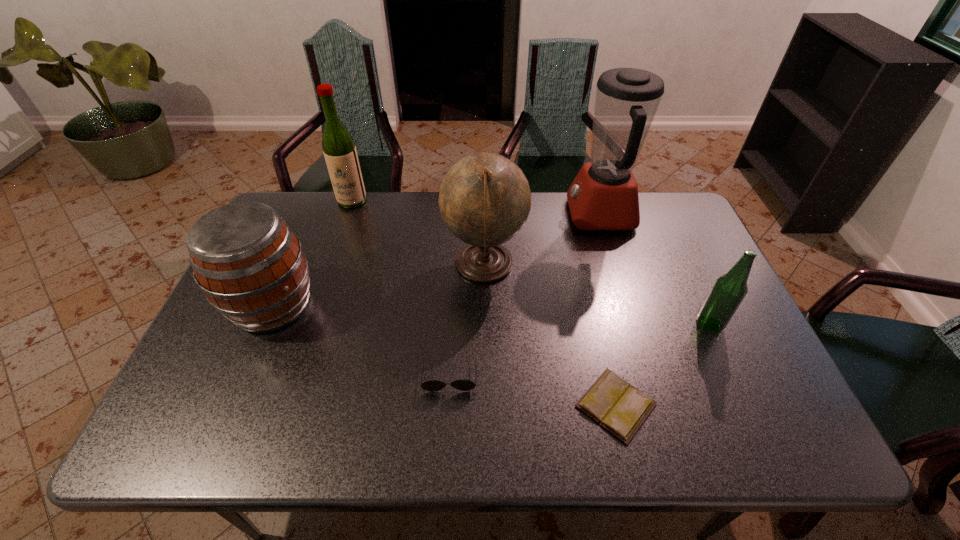
Find the location of `blender`. blender is located at coordinates (604, 195).

What are the coordinates of `liquor` in the screenshot? It's located at (339, 149).

Locate an element on the screen. The height and width of the screenshot is (540, 960). globe is located at coordinates (484, 199).

The image size is (960, 540). In order to click on cider in this screenshot , I will do `click(251, 267)`.

Locate an element on the screen. This screenshot has width=960, height=540. the rightmost object is located at coordinates (729, 290).

You are a GUI agent. You are given a task and a screenshot of the screen. Output one action in this format:
    pyautogui.click(x=<x>, y=<y>)
    Task: Click on the sunglasses
    Image resolution: width=960 pixels, height=540 pixels.
    Given the screenshot: What is the action you would take?
    pyautogui.click(x=433, y=385)

Locate an element on the screen. The width and height of the screenshot is (960, 540). the shortest object is located at coordinates (620, 408).

Where is `vacant space located 0.280m on the front of the blender near the controls`? The height and width of the screenshot is (540, 960). vacant space located 0.280m on the front of the blender near the controls is located at coordinates (482, 215).

Identify the location of free space located 0.370m on the front of the blender near the controls. The image size is (960, 540). (455, 215).

Identify the location of vacant area situated on the front of the blender near the controls. The height and width of the screenshot is (540, 960). (458, 215).